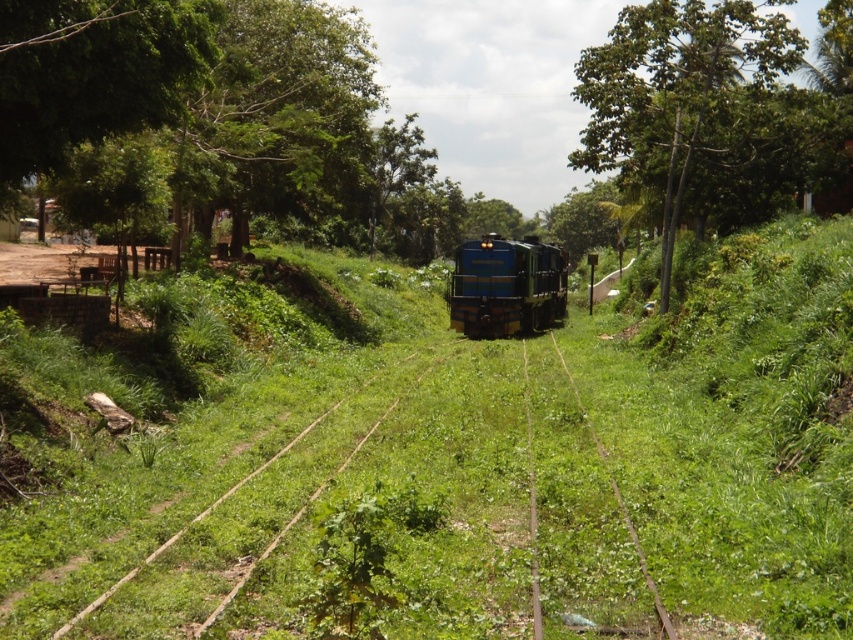
You are a passenger on the blue glossy train at center and want to look out the window to see the green leafy tree at upper center. Can you see the tree in front of the train or behind it?

The green leafy tree at upper center is closer to the viewer than the blue glossy train at center, so from the passenger perspective inside the train, the tree would be seen in front of the train.

You are a photographer aiming to capture the blue glossy train at center passing through the rural area. Considering the green leafy tree at upper center, will the tree block the view of the train in your photo?

The green leafy tree at upper center has a larger width than the blue glossy train at center, so it might block the view of the train depending on the angle and distance from which the photo is taken.